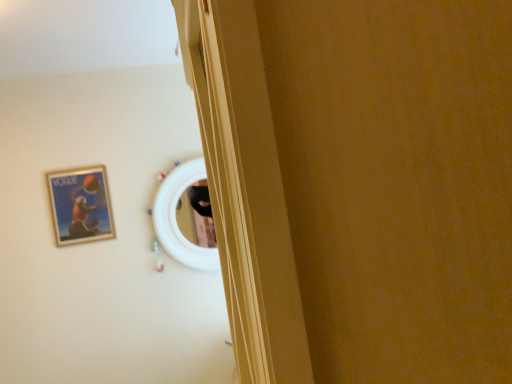
This screenshot has width=512, height=384. In order to click on white glossy mirror at center in this screenshot , I will do click(176, 221).

Measure the distance between point (193, 266) and camera.

The distance of point (193, 266) from camera is 8.18 feet.

What do you see at coordinates (176, 221) in the screenshot? I see `white glossy mirror at center` at bounding box center [176, 221].

Locate an element on the screen. wooden glossy picture frame at upper left is located at coordinates (81, 205).

What do you see at coordinates (81, 205) in the screenshot?
I see `wooden glossy picture frame at upper left` at bounding box center [81, 205].

The height and width of the screenshot is (384, 512). Find the location of `white glossy mirror at center`. white glossy mirror at center is located at coordinates (176, 221).

Which is more to the left, wooden glossy picture frame at upper left or white glossy mirror at center?

wooden glossy picture frame at upper left.

Does wooden glossy picture frame at upper left lie in front of white glossy mirror at center?

Yes, the depth of wooden glossy picture frame at upper left is less than that of white glossy mirror at center.

Which is closer, (103,225) or (168,209)?

Clearly, point (103,225) is closer to the camera than point (168,209).

Based on the photo, from the image's perspective, which object appears higher, wooden glossy picture frame at upper left or white glossy mirror at center?

wooden glossy picture frame at upper left.

From a real-world perspective, is wooden glossy picture frame at upper left physically located above or below white glossy mirror at center?

From a real-world perspective, wooden glossy picture frame at upper left is physically above white glossy mirror at center.

Which object is thinner, wooden glossy picture frame at upper left or white glossy mirror at center?

With smaller width is wooden glossy picture frame at upper left.

Based on the photo, does wooden glossy picture frame at upper left have a greater height compared to white glossy mirror at center?

In fact, wooden glossy picture frame at upper left may be shorter than white glossy mirror at center.

Considering the sizes of objects wooden glossy picture frame at upper left and white glossy mirror at center in the image provided, who is smaller, wooden glossy picture frame at upper left or white glossy mirror at center?

With smaller size is wooden glossy picture frame at upper left.

Could white glossy mirror at center be considered to be inside wooden glossy picture frame at upper left?

No, wooden glossy picture frame at upper left does not contain white glossy mirror at center.

Is wooden glossy picture frame at upper left next to white glossy mirror at center and touching it?

wooden glossy picture frame at upper left and white glossy mirror at center are clearly separated.

Could you tell me if wooden glossy picture frame at upper left is turned towards white glossy mirror at center?

No, wooden glossy picture frame at upper left is not aimed at white glossy mirror at center.

From the picture: What's the angular difference between wooden glossy picture frame at upper left and white glossy mirror at center's facing directions?

The facing directions of wooden glossy picture frame at upper left and white glossy mirror at center are 0.141 degrees apart.

Measure the distance between wooden glossy picture frame at upper left and white glossy mirror at center.

The distance of wooden glossy picture frame at upper left from white glossy mirror at center is 16.18 inches.

Locate an element on the screen. mirror behind the wooden glossy picture frame at upper left is located at coordinates (176, 221).

Can you confirm if white glossy mirror at center is positioned to the left of wooden glossy picture frame at upper left?

No.

In the image, is white glossy mirror at center positioned in front of or behind wooden glossy picture frame at upper left?

Visually, white glossy mirror at center is located behind wooden glossy picture frame at upper left.

Between point (170, 222) and point (68, 221), which one is positioned behind?

The point (170, 222) is farther.

From the image's perspective, is white glossy mirror at center beneath wooden glossy picture frame at upper left?

Indeed, from the image's perspective, white glossy mirror at center is shown beneath wooden glossy picture frame at upper left.

From a real-world perspective, is white glossy mirror at center on wooden glossy picture frame at upper left?

No, from a real-world perspective, white glossy mirror at center is not above wooden glossy picture frame at upper left.

Considering the sizes of objects white glossy mirror at center and wooden glossy picture frame at upper left in the image provided, who is thinner, white glossy mirror at center or wooden glossy picture frame at upper left?

wooden glossy picture frame at upper left is thinner.

Considering the sizes of objects white glossy mirror at center and wooden glossy picture frame at upper left in the image provided, who is shorter, white glossy mirror at center or wooden glossy picture frame at upper left?

With less height is wooden glossy picture frame at upper left.

Can you confirm if white glossy mirror at center is smaller than wooden glossy picture frame at upper left?

Incorrect, white glossy mirror at center is not smaller in size than wooden glossy picture frame at upper left.

Is wooden glossy picture frame at upper left a part of white glossy mirror at center?

No, wooden glossy picture frame at upper left is not inside white glossy mirror at center.

Is the surface of white glossy mirror at center in direct contact with wooden glossy picture frame at upper left?

No, white glossy mirror at center is not in contact with wooden glossy picture frame at upper left.

Is white glossy mirror at center aimed at wooden glossy picture frame at upper left?

No, white glossy mirror at center is not oriented towards wooden glossy picture frame at upper left.

How many degrees apart are the facing directions of white glossy mirror at center and wooden glossy picture frame at upper left?

0.141 degrees separate the facing orientations of white glossy mirror at center and wooden glossy picture frame at upper left.

How far apart are white glossy mirror at center and wooden glossy picture frame at upper left?

white glossy mirror at center is 41.10 centimeters from wooden glossy picture frame at upper left.

Where is `mirror lying behind the wooden glossy picture frame at upper left`? The width and height of the screenshot is (512, 384). mirror lying behind the wooden glossy picture frame at upper left is located at coordinates (176, 221).

In order to click on mirror below the wooden glossy picture frame at upper left (from the image's perspective) in this screenshot , I will do coord(176,221).

This screenshot has height=384, width=512. In the image, there is a wooden glossy picture frame at upper left. What are the coordinates of `mirror below it (from a real-world perspective)` in the screenshot? It's located at (176, 221).